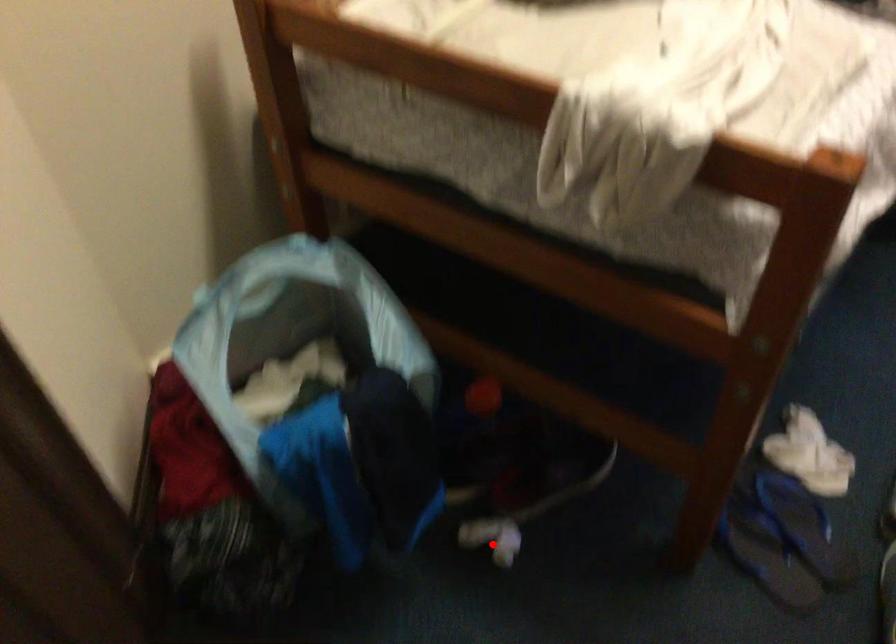
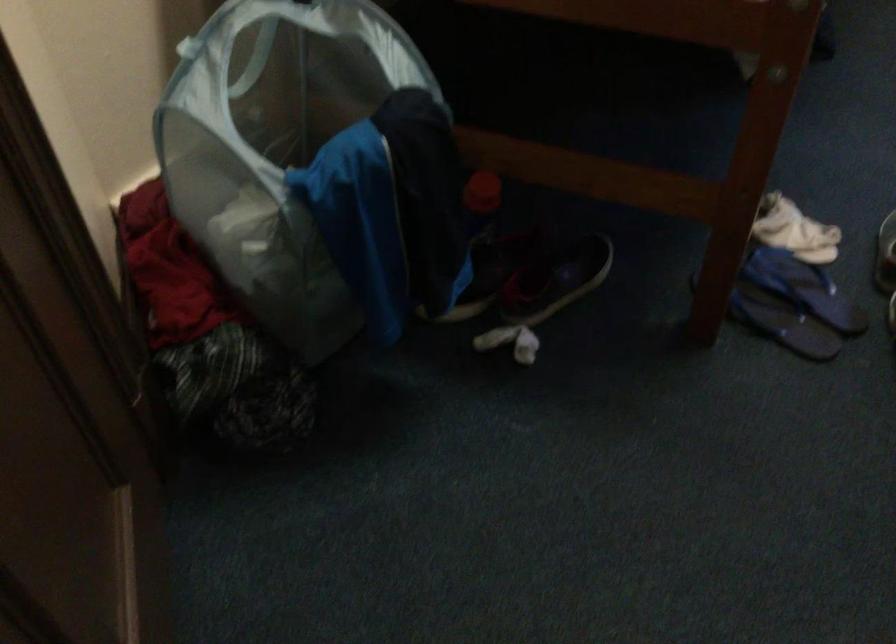
Locate, in the second image, the point that corresponds to the highlighted location in the first image.

(510, 342)